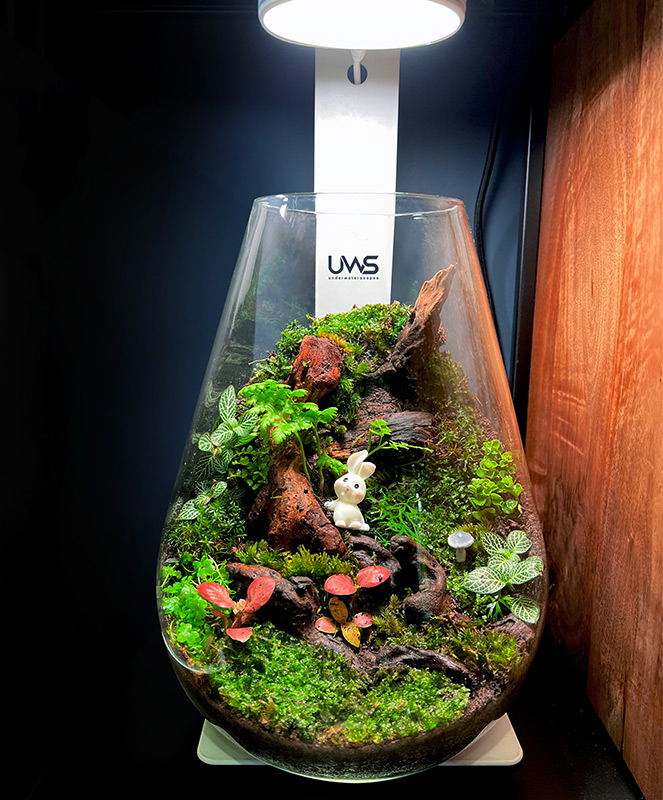
At what (x,y) coordinates should I click in order to perform the action: click on light. Please return your answer as a coordinate pair (x, y). Looking at the image, I should click on (372, 26).